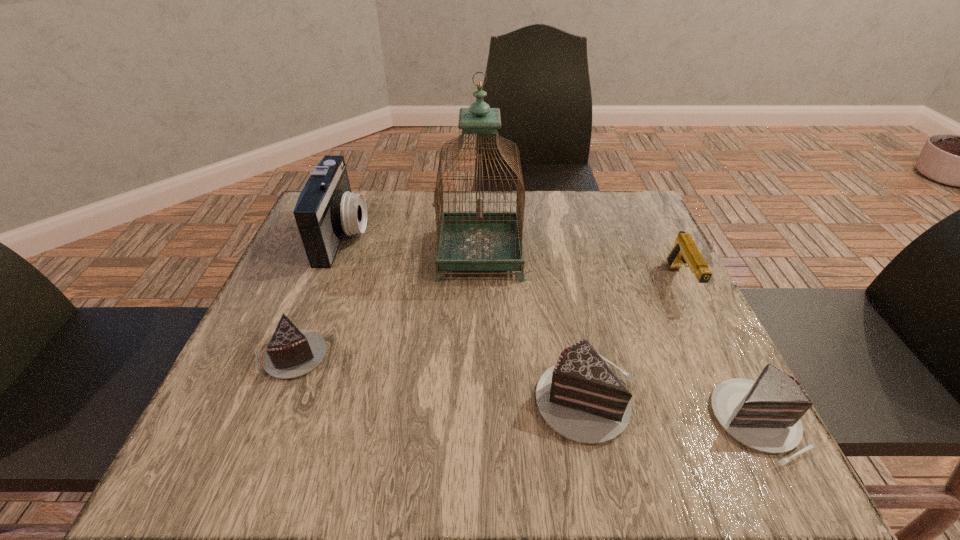
Where is `object that is at the far left corner`? The width and height of the screenshot is (960, 540). object that is at the far left corner is located at coordinates (326, 209).

I want to click on object that is at the near left corner, so click(291, 352).

At what (x,y) coordinates should I click in order to perform the action: click on object at the near right corner. Please return your answer as a coordinate pair (x, y). Image resolution: width=960 pixels, height=540 pixels. Looking at the image, I should click on (764, 415).

In the image, there is a desktop. Identify the location of vacant space at the far edge. The width and height of the screenshot is (960, 540). (374, 216).

What are the coordinates of `free region at the near edge` in the screenshot? It's located at pyautogui.click(x=504, y=413).

The height and width of the screenshot is (540, 960). Find the location of `free space at the left edge of the desktop`. free space at the left edge of the desktop is located at coordinates (359, 251).

Identify the location of vacant area at the right edge of the desktop. pos(612,244).

Where is `vacant region at the far left corner`? This screenshot has height=540, width=960. vacant region at the far left corner is located at coordinates (298, 239).

Where is `free space at the far right corner of the desktop`? The height and width of the screenshot is (540, 960). free space at the far right corner of the desktop is located at coordinates tap(642, 217).

Image resolution: width=960 pixels, height=540 pixels. What are the coordinates of `free space between the shortest object and the birdcage` in the screenshot? It's located at (385, 305).